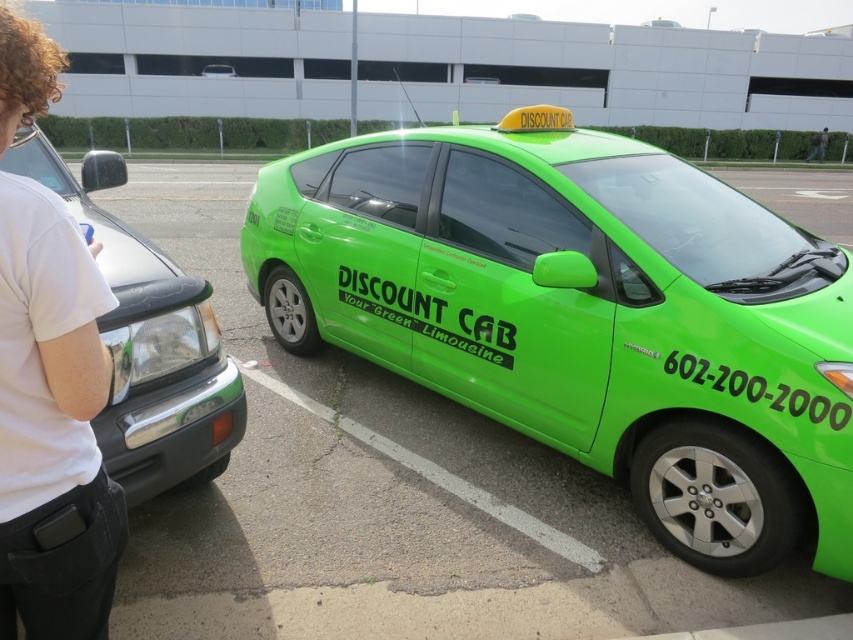
Is green matte taxi at center smaller than white fabric shirt at left?

Actually, green matte taxi at center might be larger than white fabric shirt at left.

Can you confirm if green matte taxi at center is wider than white fabric shirt at left?

Yes, green matte taxi at center is wider than white fabric shirt at left.

Describe the element at coordinates (583, 314) in the screenshot. This screenshot has width=853, height=640. I see `green matte taxi at center` at that location.

This screenshot has width=853, height=640. I want to click on green matte taxi at center, so click(583, 314).

The width and height of the screenshot is (853, 640). What do you see at coordinates (51, 422) in the screenshot? I see `white fabric shirt at left` at bounding box center [51, 422].

Which is behind, point (26, 272) or point (16, 156)?

Point (16, 156)

I want to click on white fabric shirt at left, so pos(51,422).

Looking at this image, which is more to the left, green matte taxi at center or green matte taxi at upper center?

green matte taxi at upper center is more to the left.

Can you confirm if green matte taxi at center is bigger than green matte taxi at upper center?

Yes.

Between point (467, 372) and point (219, 70), which one is positioned in front?

Positioned in front is point (467, 372).

Where is `green matte taxi at center`? This screenshot has width=853, height=640. green matte taxi at center is located at coordinates (583, 314).